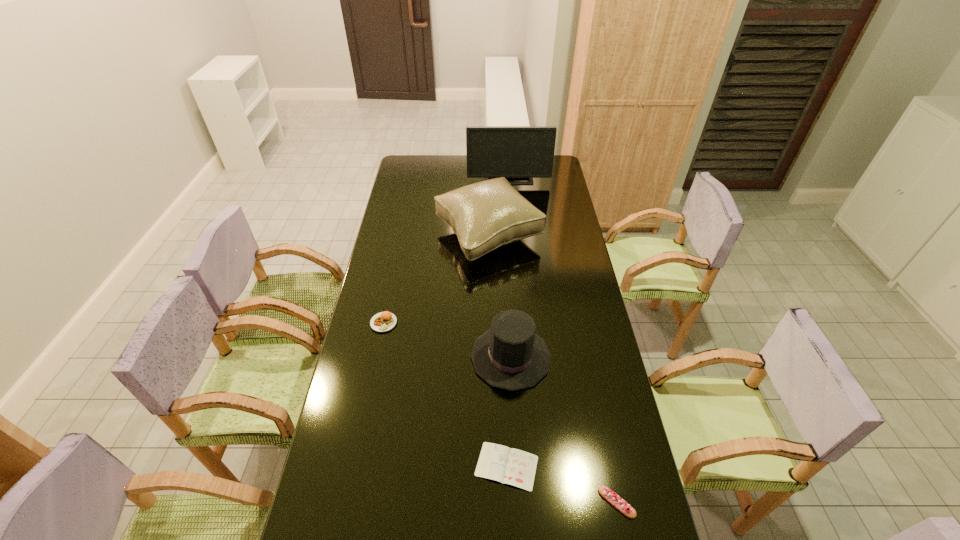
Locate an element on the screen. cushion located in the right edge section of the desktop is located at coordinates (486, 215).

Find the location of a particular element. The image size is (960, 540). eclair positioned at the right edge is located at coordinates (612, 497).

The image size is (960, 540). What are the coordinates of `object that is at the far right corner` in the screenshot? It's located at (514, 152).

Find the location of a particular element. This screenshot has height=540, width=960. free spot at the left edge of the desktop is located at coordinates (366, 313).

At what (x,y) coordinates should I click in order to perform the action: click on vacant area at the right edge. Please return your answer as a coordinate pair (x, y). Looking at the image, I should click on (562, 235).

Image resolution: width=960 pixels, height=540 pixels. I want to click on empty space between the dress hat and the patty, so (x=447, y=340).

The height and width of the screenshot is (540, 960). What are the coordinates of `vacant space that's between the fifth tallest object and the shortest object` in the screenshot? It's located at (562, 484).

Locate an element on the screen. free area in between the tallest object and the eclair is located at coordinates (563, 340).

Identify the location of unoccupied area between the farthest object and the fourth shortest object. This screenshot has height=540, width=960. (510, 267).

Locate an element on the screen. unoccupied area between the dress hat and the farthest object is located at coordinates (510, 267).